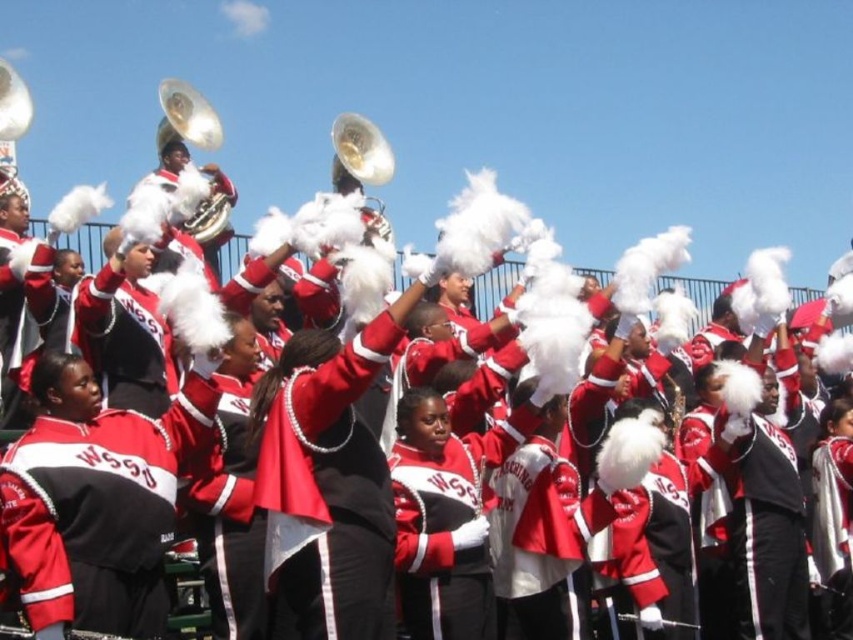
Based on the photo, you are a photographer standing at the camera position. You want to take a closeup shot of the matte red jacket at center. Given that your camera can focus on objects within 50 meters, will you be able to capture a clear closeup?

The matte red jacket at center is 68.00 meters away from camera, which is beyond the camera focus range of 50 meters. Therefore, you cannot capture a clear closeup.

You are a photographer trying to capture the entire marching band in a single photo. You notice the matte red jacket at center and the shiny brass tuba at upper left in your viewfinder. Which object should you focus on to ensure both are in frame without cropping?

The matte red jacket at center is larger in size than the shiny brass tuba at upper left, so focusing on the matte red jacket at center will ensure both objects remain in frame as it takes up more space.

You are a photographer standing in front of the marching band. You want to take a photo that includes both the red matte jacket at center and the shiny brass tuba at upper left. Based on their positions, which object should you adjust your camera to focus on first to ensure both are in frame?

The red matte jacket at center is to the right of the shiny brass tuba at upper left, so you should focus on the shiny brass tuba at upper left first to ensure both are captured in the frame.